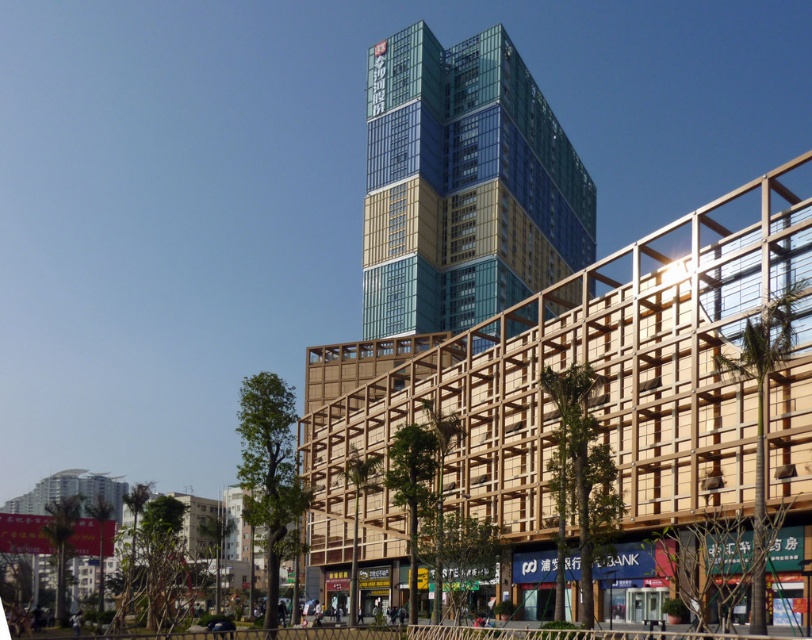
Question: Which point is closer to the camera?

Choices:
 (A) blue glass building at center
 (B) wooden lattice structure at center

Answer: (B)

Question: Can you confirm if wooden lattice structure at center is positioned above blue glass building at center?

Choices:
 (A) no
 (B) yes

Answer: (A)

Question: Considering the relative positions of wooden lattice structure at center and blue glass building at center in the image provided, where is wooden lattice structure at center located with respect to blue glass building at center?

Choices:
 (A) right
 (B) left

Answer: (A)

Question: Which point appears farthest from the camera in this image?

Choices:
 (A) (430, 273)
 (B) (564, 300)

Answer: (A)

Question: Can you confirm if wooden lattice structure at center is positioned to the left of blue glass building at center?

Choices:
 (A) no
 (B) yes

Answer: (A)

Question: Which of the following is the farthest from the observer?

Choices:
 (A) tap(555, 225)
 (B) tap(798, 161)

Answer: (A)